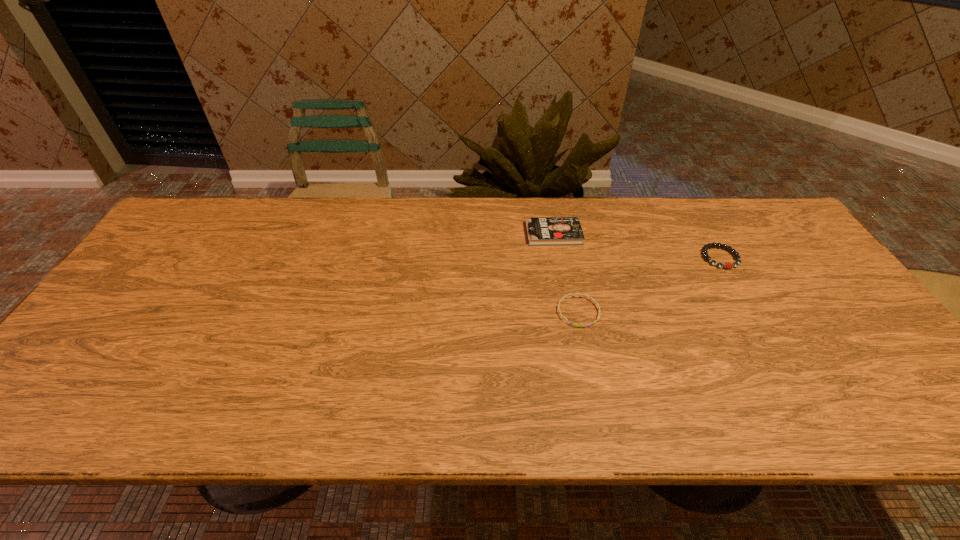
In the image, there is a desktop. Identify the location of free space at the far edge. This screenshot has height=540, width=960. (514, 237).

Where is `vacant space at the near edge`? vacant space at the near edge is located at coordinates (460, 395).

Identify the location of free space at the left edge of the desktop. (120, 316).

Image resolution: width=960 pixels, height=540 pixels. Find the location of `vacant space at the right edge of the desktop`. vacant space at the right edge of the desktop is located at coordinates (798, 293).

You are a GUI agent. You are given a task and a screenshot of the screen. Output one action in this format:
    pyautogui.click(x=<x>, y=<y>)
    Task: Click on the free region at the near right corner of the desktop
    Image resolution: width=960 pixels, height=540 pixels.
    Given the screenshot: What is the action you would take?
    pyautogui.click(x=895, y=397)

This screenshot has height=540, width=960. In order to click on blank region between the rightmost object and the nearest object in this screenshot , I will do `click(649, 285)`.

Locate an element on the screen. This screenshot has height=540, width=960. empty space between the tallest object and the rightmost object is located at coordinates (636, 246).

Locate an element on the screen. Image resolution: width=960 pixels, height=540 pixels. empty space that is in between the tallest object and the right bracelet is located at coordinates (636, 246).

This screenshot has width=960, height=540. Identify the location of empty space that is in between the tallest object and the nearer bracelet. (565, 273).

Image resolution: width=960 pixels, height=540 pixels. I want to click on free spot between the book and the left bracelet, so click(x=565, y=273).